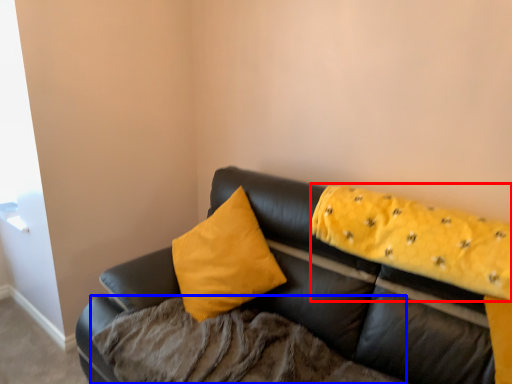
Question: Which object is closer to the camera taking this photo, blanket (highlighted by a red box) or bedding (highlighted by a blue box)?

Choices:
 (A) blanket
 (B) bedding

Answer: (B)